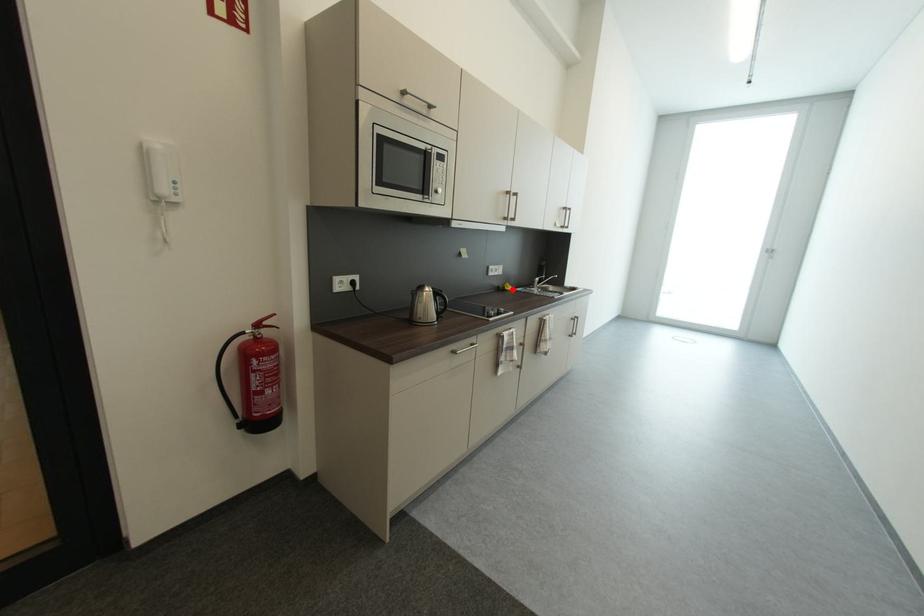
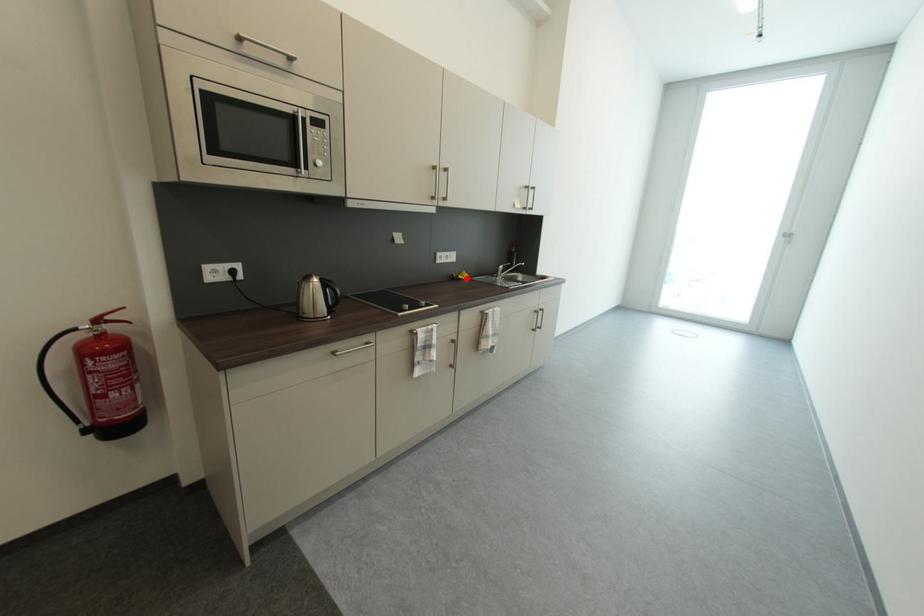
I am providing you with two images of the same scene from different viewpoints. A red point is marked on the first image and another point is marked on the second image. Are the points marked in image1 and image2 representing the same 3D position?

Yes